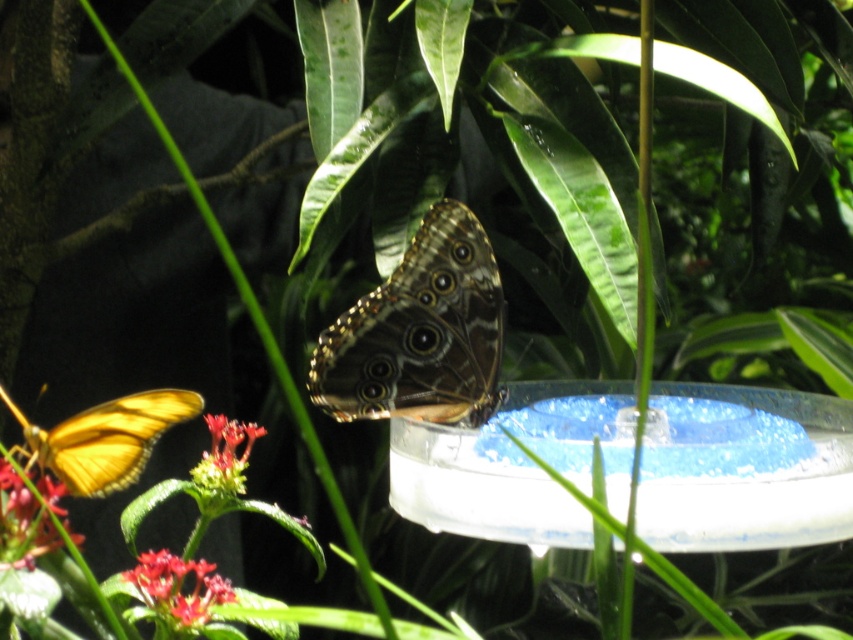
Question: Is smooth yellow flower at lower left bigger than smooth red flower at lower left?

Choices:
 (A) yes
 (B) no

Answer: (B)

Question: Is translucent yellow butterfly at lower left positioned at the back of smooth yellow flower at lower left?

Choices:
 (A) no
 (B) yes

Answer: (B)

Question: From the image, what is the correct spatial relationship of translucent yellow butterfly at lower left in relation to smooth red flower at lower left?

Choices:
 (A) right
 (B) left

Answer: (B)

Question: Which of the following is the closest to the observer?

Choices:
 (A) (202, 596)
 (B) (242, 490)

Answer: (A)

Question: Which object is positioned farthest from the smooth red petals at lower left?

Choices:
 (A) smooth red flower at lower left
 (B) translucent yellow butterfly at lower left
 (C) brown textured butterfly at center
 (D) smooth yellow flower at lower left

Answer: (C)

Question: Which is nearer to the smooth red petals at lower left?

Choices:
 (A) smooth red flower at lower left
 (B) translucent yellow butterfly at lower left
 (C) brown textured butterfly at center

Answer: (B)